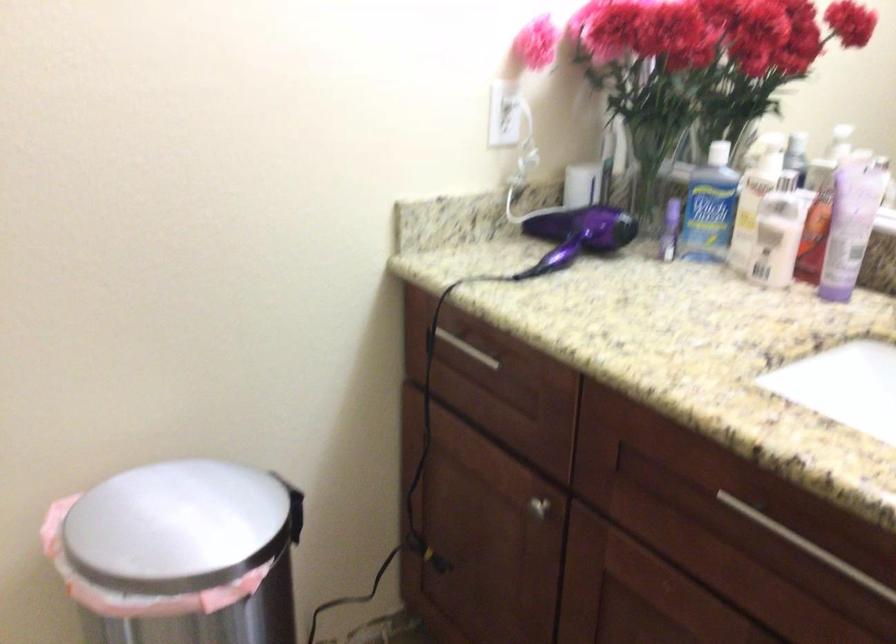
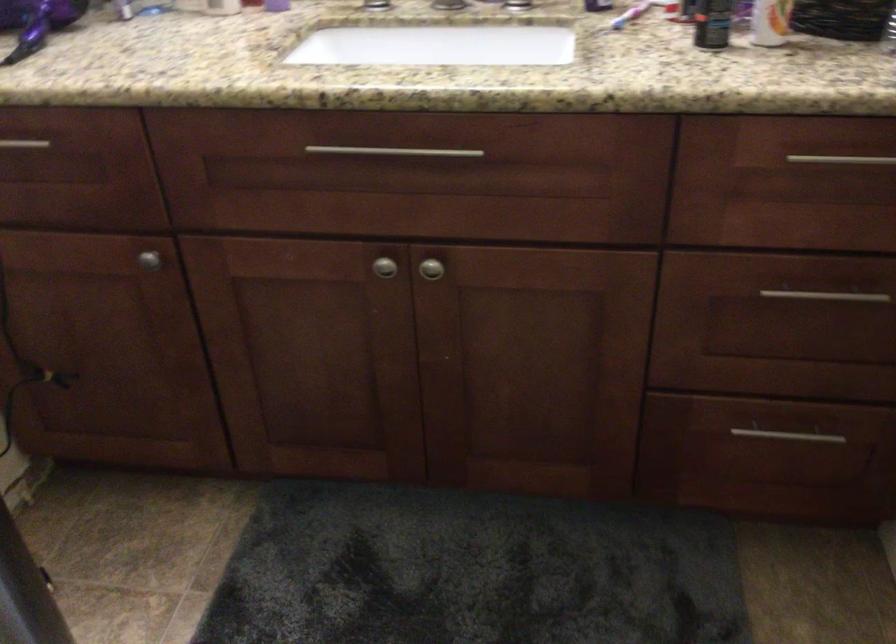
The point at (531, 504) is marked in the first image. Where is the corresponding point in the second image?

(149, 259)